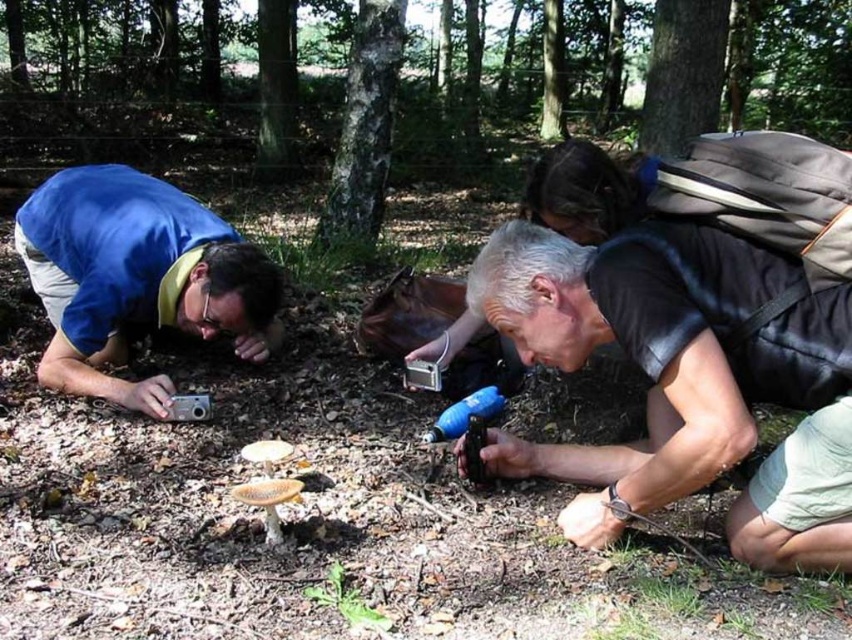
Question: Can you confirm if matte blue shirt at lower left is positioned above smooth bark tree at center?

Choices:
 (A) no
 (B) yes

Answer: (A)

Question: Is smooth bark tree at center below smooth bark tree at upper center?

Choices:
 (A) no
 (B) yes

Answer: (B)

Question: Which of the following is the farthest from the observer?

Choices:
 (A) (692, 131)
 (B) (350, 68)
 (C) (373, 616)

Answer: (A)

Question: Which object is positioned farthest from the smooth bark tree at upper center?

Choices:
 (A) smooth bark tree at center
 (B) green leafy plant at center
 (C) matte blue shirt at lower left

Answer: (B)

Question: Does black matte camera at lower right appear on the left side of green leafy plant at center?

Choices:
 (A) no
 (B) yes

Answer: (A)

Question: Estimate the real-world distances between objects in this image. Which object is closer to the black matte camera at lower right?

Choices:
 (A) smooth bark tree at center
 (B) green leafy plant at center

Answer: (B)